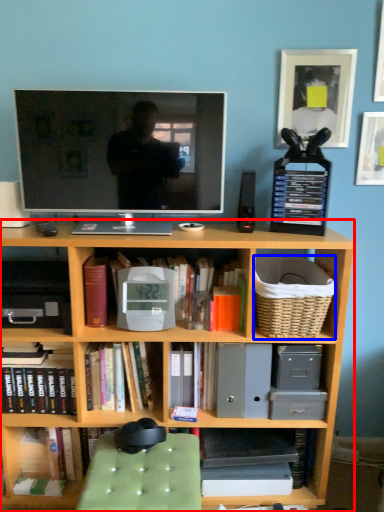
Question: Which point is further to the camera, bookcase (highlighted by a red box) or basket (highlighted by a blue box)?

Choices:
 (A) bookcase
 (B) basket

Answer: (B)